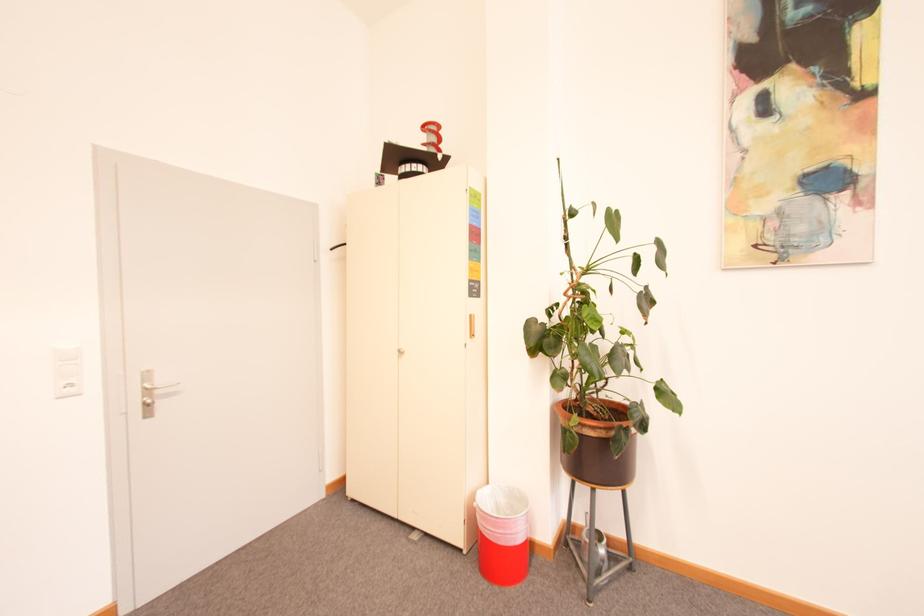
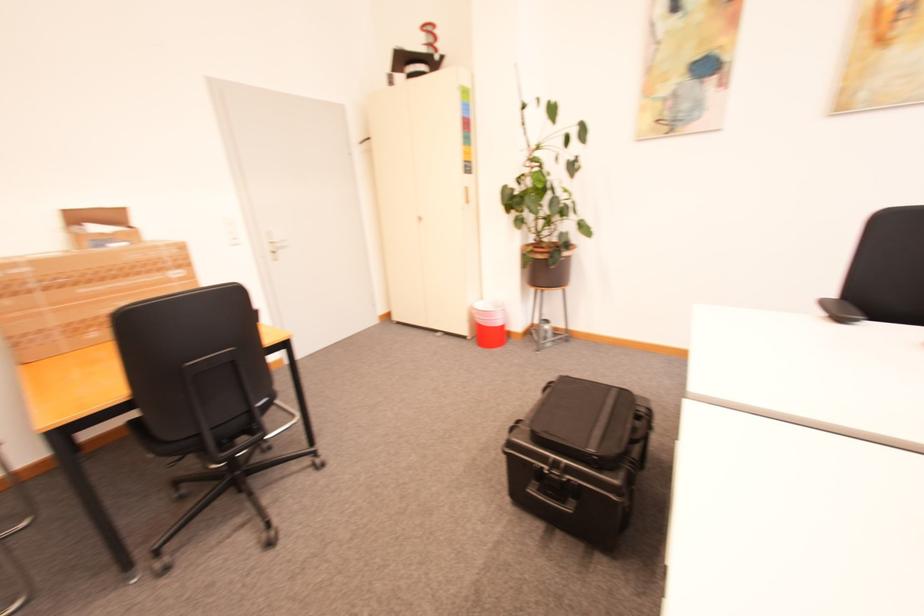
Where in the second image is the point corresponding to the point at 479,336 from the first image?

(473, 203)